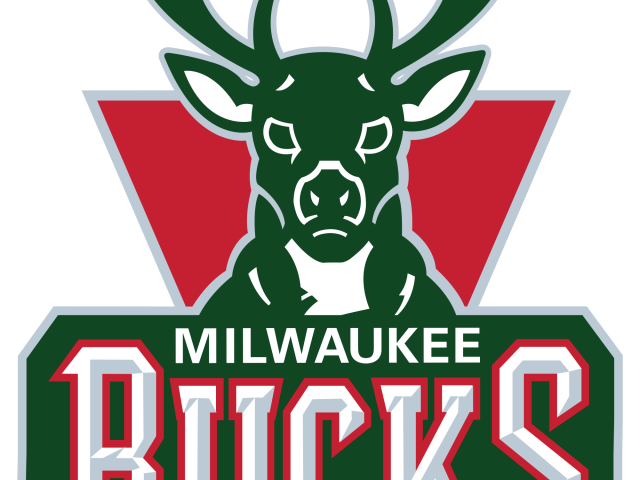
Locate an element on the screen. The height and width of the screenshot is (480, 640). corner is located at coordinates (54, 339).